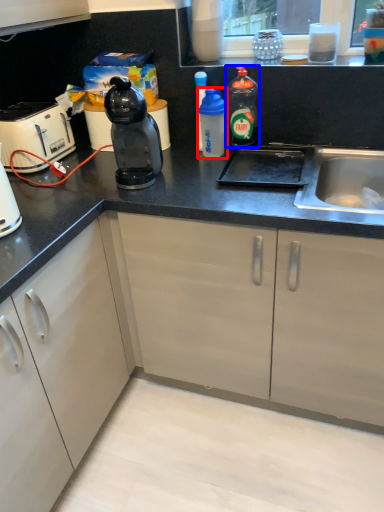
Question: Which of the following is the closest to the observer, bottle (highlighted by a red box) or bottle (highlighted by a blue box)?

Choices:
 (A) bottle
 (B) bottle

Answer: (A)